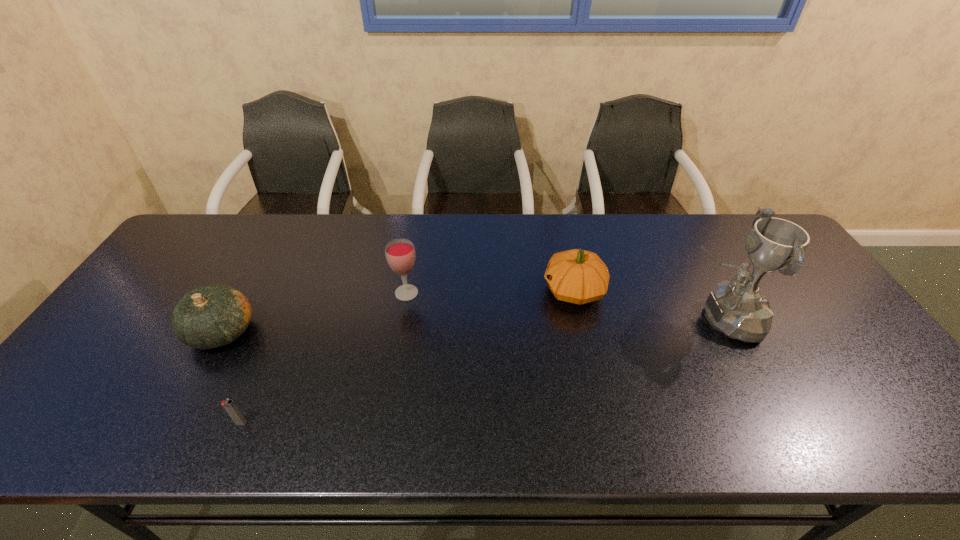
Find the location of a particular element. vacant region located 0.110m on the front of the third object from right to left is located at coordinates (399, 333).

Where is `blank space located on the side of the right gourd with the carved face`? This screenshot has height=540, width=960. blank space located on the side of the right gourd with the carved face is located at coordinates (487, 291).

I want to click on vacant space situated on the side of the right gourd with the carved face, so click(491, 291).

Locate an element on the screen. free space located 0.390m on the side of the right gourd with the carved face is located at coordinates (407, 291).

What are the coordinates of `vacant space located 0.120m on the back of the left gourd` in the screenshot? It's located at (252, 278).

Where is `blank space located on the right of the shortest object`? The image size is (960, 540). blank space located on the right of the shortest object is located at coordinates (274, 423).

This screenshot has width=960, height=540. I want to click on object situated at the near edge, so click(x=230, y=407).

In the image, there is a desktop. In order to click on vacant space at the far edge in this screenshot , I will do `click(477, 231)`.

Image resolution: width=960 pixels, height=540 pixels. In the image, there is a desktop. In order to click on vacant space at the near edge in this screenshot , I will do `click(612, 411)`.

Find the location of a particular element. free space at the left edge of the desktop is located at coordinates pos(96,347).